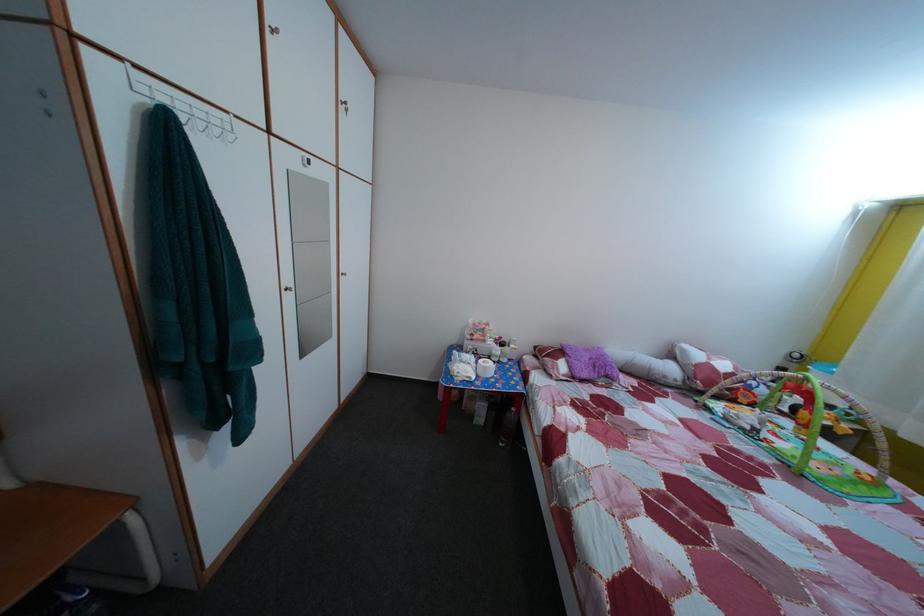
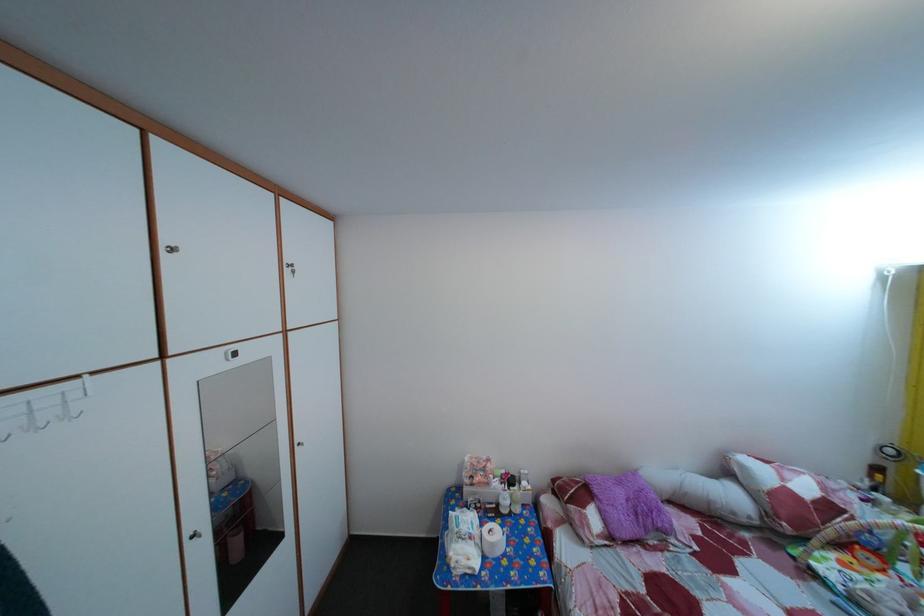
Where in the second image is the point corresponding to pixel 356 118 from the first image?

(304, 280)